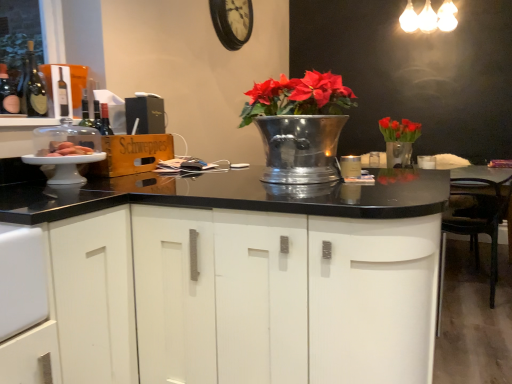
Measure the distance between wooden clock at upper center and camera.

A distance of 9.55 feet exists between wooden clock at upper center and camera.

Image resolution: width=512 pixels, height=384 pixels. What do you see at coordinates (8, 93) in the screenshot?
I see `matte black wine bottle at left` at bounding box center [8, 93].

What is the approximate height of matte black wine bottle at left?

It is 26.20 centimeters.

Identify the location of matte white cake at left. (65, 149).

Identify the location of wooden clock at upper center. (232, 21).

Looking at this image, from the image's perspective, is wooden clock at upper center beneath black leather chair at right?

Actually, wooden clock at upper center appears above black leather chair at right in the image.

Is wooden clock at upper center touching black leather chair at right?

No, wooden clock at upper center is not making contact with black leather chair at right.

What are the coordinates of `chair located underneath the wooden clock at upper center (from a real-world perspective)` in the screenshot? It's located at (474, 225).

From a real-world perspective, is matte black wine bottle at left physically above black leather chair at right?

Correct, in the physical world, matte black wine bottle at left is higher than black leather chair at right.

Is matte black wine bottle at left at the right side of black leather chair at right?

In fact, matte black wine bottle at left is to the left of black leather chair at right.

In the image, is matte black wine bottle at left positioned in front of or behind black leather chair at right?

matte black wine bottle at left is in front of black leather chair at right.

Locate an element on the screen. This screenshot has height=384, width=512. food on the left of metallic silver vase at center is located at coordinates (65, 149).

Does metallic silver vase at center touch matte white cake at left?

No, metallic silver vase at center is not making contact with matte white cake at left.

Which of these two, metallic silver vase at center or matte white cake at left, stands shorter?

matte white cake at left.

Considering the relative positions of metallic silver vase at center and matte white cake at left in the image provided, is metallic silver vase at center in front of matte white cake at left?

That is True.

Measure the distance from wooden clock at upper center to matte white cake at left.

They are 1.84 meters apart.

From the image's perspective, between wooden clock at upper center and matte white cake at left, who is located below?

matte white cake at left, from the image's perspective.

Is wooden clock at upper center at the right side of matte white cake at left?

Correct, you'll find wooden clock at upper center to the right of matte white cake at left.

Is wooden clock at upper center surrounding matte white cake at left?

No, matte white cake at left is not a part of wooden clock at upper center.

Does white matte cabinet at center have a larger size compared to black leather chair at right?

Yes, white matte cabinet at center is bigger than black leather chair at right.

From the image's perspective, who appears lower, white matte cabinet at center or black leather chair at right?

white matte cabinet at center, from the image's perspective.

This screenshot has width=512, height=384. In order to click on cabinetry in front of the black leather chair at right in this screenshot , I will do `click(221, 280)`.

Based on their positions, is white matte cabinet at center located to the left or right of black leather chair at right?

In the image, white matte cabinet at center appears on the left side of black leather chair at right.

In the scene shown: Is matte black wine bottle at left facing towards white matte cabinet at center?

No, matte black wine bottle at left does not turn towards white matte cabinet at center.

From a real-world perspective, is matte black wine bottle at left physically located above or below white matte cabinet at center?

Clearly, from a real-world perspective, matte black wine bottle at left is above white matte cabinet at center.

From the image's perspective, relative to white matte cabinet at center, is matte black wine bottle at left above or below?

Based on their image positions, matte black wine bottle at left is located above white matte cabinet at center.

Is point (10, 107) closer or farther from the camera than point (389, 290)?

Point (10, 107) is positioned farther from the camera compared to point (389, 290).

Where is `cabinetry beneath the wooden clock at upper center (from a real-world perspective)`? cabinetry beneath the wooden clock at upper center (from a real-world perspective) is located at coordinates (221, 280).

Which of these two, white matte cabinet at center or wooden clock at upper center, stands shorter?

wooden clock at upper center.

Is white matte cabinet at center facing towards wooden clock at upper center?

No, white matte cabinet at center is not facing towards wooden clock at upper center.

I want to click on chair in front of the wooden clock at upper center, so click(474, 225).

This screenshot has width=512, height=384. I want to click on chair below the matte black wine bottle at left (from a real-world perspective), so click(474, 225).

Looking at the image, which one is located closer to matte white cake at left, matte black wine bottle at left or black leather chair at right?

matte black wine bottle at left is positioned closer to the anchor matte white cake at left.

Which object lies nearer to the anchor point black leather chair at right, matte black wine bottle at left or white matte cabinet at center?

white matte cabinet at center.

Based on their spatial positions, is matte black wine bottle at left or matte white cake at left further from black leather chair at right?

matte black wine bottle at left lies further to black leather chair at right than the other object.

Consider the image. Estimate the real-world distances between objects in this image. Which object is further from matte black wine bottle at left, metallic silver vase at center or matte white cake at left?

metallic silver vase at center.

When comparing their distances from white matte cabinet at center, does matte black wine bottle at left or matte black wine bottle at left seem further?

matte black wine bottle at left is positioned further to the anchor white matte cabinet at center.

Looking at the image, which one is located closer to matte black wine bottle at left, white matte cabinet at center or wooden clock at upper center?

wooden clock at upper center is positioned closer to the anchor matte black wine bottle at left.

From the image, which object appears to be nearer to matte black wine bottle at left, white matte cabinet at center or matte white cake at left?

matte white cake at left is closer to matte black wine bottle at left.

Looking at the image, which one is located closer to wooden clock at upper center, black leather chair at right or white matte cabinet at center?

black leather chair at right.

The image size is (512, 384). I want to click on houseplant between white matte cabinet at center and black leather chair at right from left to right, so click(298, 125).

This screenshot has height=384, width=512. What are the coordinates of `food situated between matte black wine bottle at left and black leather chair at right from left to right` in the screenshot? It's located at (65, 149).

You are a GUI agent. You are given a task and a screenshot of the screen. Output one action in this format:
    pyautogui.click(x=<x>, y=<y>)
    Task: Click on the bottle between matte white cake at left and wooden clock at upper center along the z-axis
    This screenshot has height=384, width=512.
    Given the screenshot: What is the action you would take?
    pyautogui.click(x=8, y=93)

Identify the location of chair positioned between metallic silver vase at center and wooden clock at upper center from near to far. (474, 225).